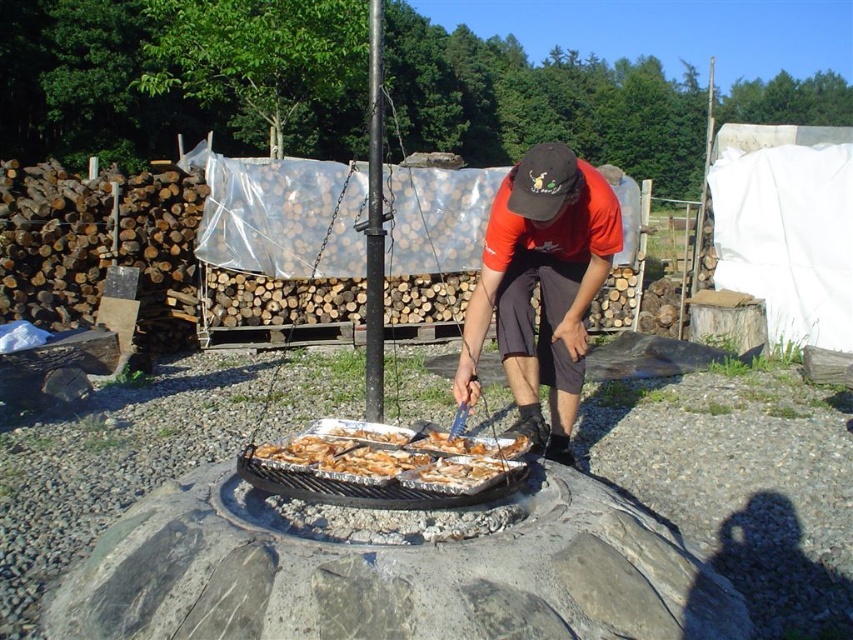
You are standing at the point marked as point (541, 288). What object are you currently standing on?

You are standing on the orange tshirt at center.